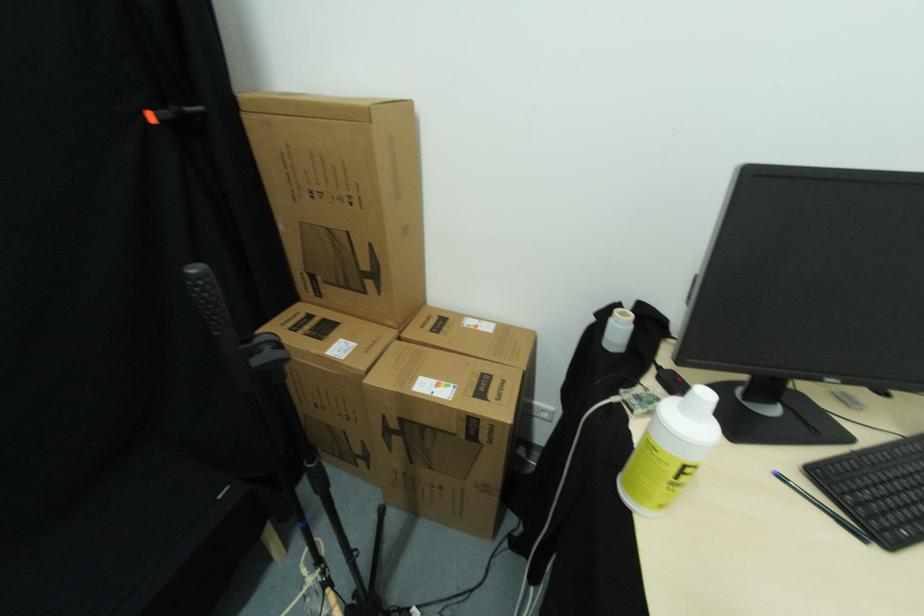
The height and width of the screenshot is (616, 924). What do you see at coordinates (341, 552) in the screenshot?
I see `the black stand handle` at bounding box center [341, 552].